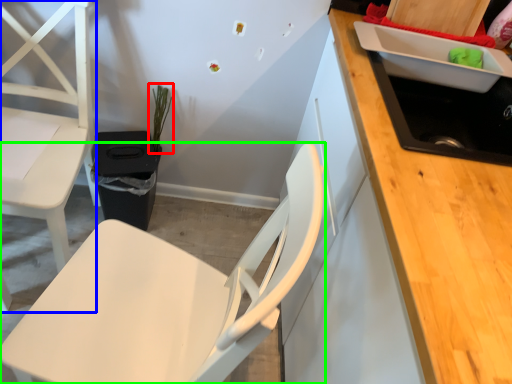
Question: Estimate the real-world distances between objects in this image. Which object is closer to plant (highlighted by a red box), chair (highlighted by a blue box) or chair (highlighted by a green box)?

Choices:
 (A) chair
 (B) chair

Answer: (A)